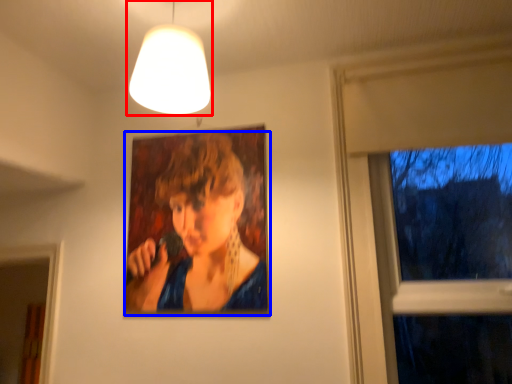
Question: Which object is closer to the camera taking this photo, lamp (highlighted by a red box) or person (highlighted by a blue box)?

Choices:
 (A) lamp
 (B) person

Answer: (A)